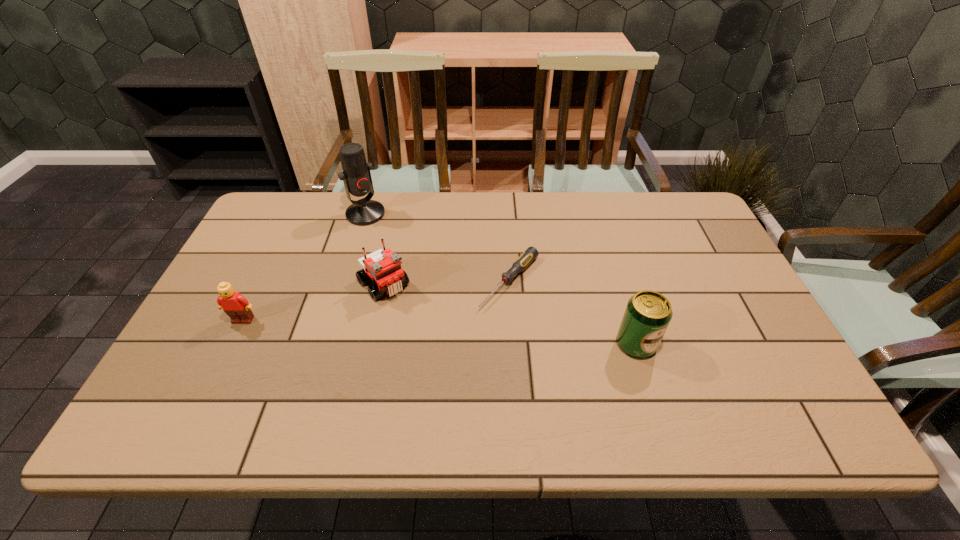
Image resolution: width=960 pixels, height=540 pixels. Identify the location of vacant area in the image that satisfies the following two spatial constraints: 1. on the front side of the farthest object; 2. on the left side of the rightmost object. (326, 344).

This screenshot has width=960, height=540. Identify the location of vacant region that satisfies the following two spatial constraints: 1. on the front side of the tallest object; 2. on the right side of the screwdriver. (346, 281).